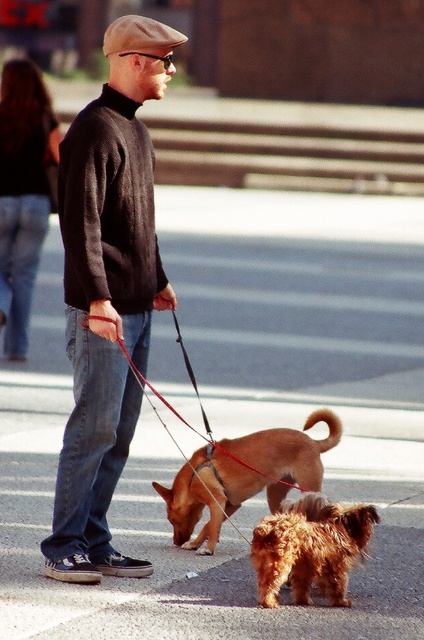
Is dark gray sweater at center below fuzzy brown dog at lower center?

No, dark gray sweater at center is not below fuzzy brown dog at lower center.

The image size is (424, 640). What do you see at coordinates (106, 292) in the screenshot?
I see `dark gray sweater at center` at bounding box center [106, 292].

Describe the element at coordinates (106, 292) in the screenshot. Image resolution: width=424 pixels, height=640 pixels. I see `dark gray sweater at center` at that location.

The height and width of the screenshot is (640, 424). In order to click on dark gray sweater at center in this screenshot , I will do `click(106, 292)`.

Based on the photo, can you confirm if brushed metal dog at center is positioned to the left of red nylon leash at center?

Indeed, brushed metal dog at center is positioned on the left side of red nylon leash at center.

Is brushed metal dog at center bigger than red nylon leash at center?

Yes, brushed metal dog at center is bigger than red nylon leash at center.

Identify the location of brushed metal dog at center. (22, 193).

Is point (33, 106) less distant than point (273, 476)?

No, it is behind (273, 476).

Does point (27, 109) come behind point (310, 422)?

Yes, point (27, 109) is behind point (310, 422).

Is point (33, 269) more distant than point (228, 440)?

That is True.

Where is `brushed metal dog at center`? This screenshot has height=640, width=424. brushed metal dog at center is located at coordinates (22, 193).